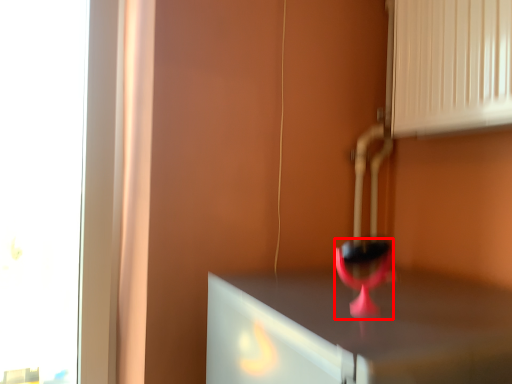
Question: From the image's perspective, where is wine glass (annotated by the red box) located in relation to vent in the image?

Choices:
 (A) above
 (B) below

Answer: (B)